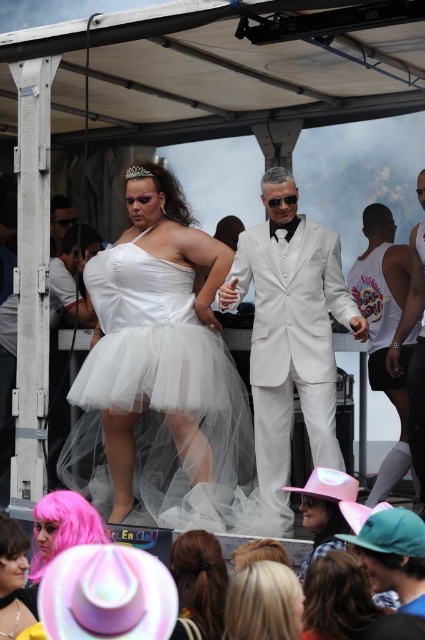
Does white satin suit at center have a lesser width compared to black matte wig at center?

No.

Can you confirm if white satin suit at center is shorter than black matte wig at center?

Incorrect, white satin suit at center's height does not fall short of black matte wig at center's.

Is point (272, 289) closer to camera compared to point (265, 173)?

Yes.

In order to click on white satin suit at center in this screenshot , I will do `click(291, 337)`.

Between point (82, 540) and point (272, 179), which one is positioned in front?

Point (82, 540) is more forward.

Does pink synthetic wig at lower left appear under black matte wig at center?

Indeed, pink synthetic wig at lower left is positioned under black matte wig at center.

Which is behind, point (70, 532) or point (280, 170)?

Positioned behind is point (280, 170).

The height and width of the screenshot is (640, 425). Identify the location of pink synthetic wig at lower left. click(x=62, y=528).

Between point (176, 374) and point (302, 500), which one is positioned in front?

Point (302, 500) is more forward.

How far apart are white tulle dress at center and pink felt cowboy hat at lower center?

white tulle dress at center is 9.36 feet away from pink felt cowboy hat at lower center.

Does point (166, 268) lie behind point (306, 561)?

Yes, it is behind point (306, 561).

Locate an element on the screen. white tulle dress at center is located at coordinates click(x=158, y=371).